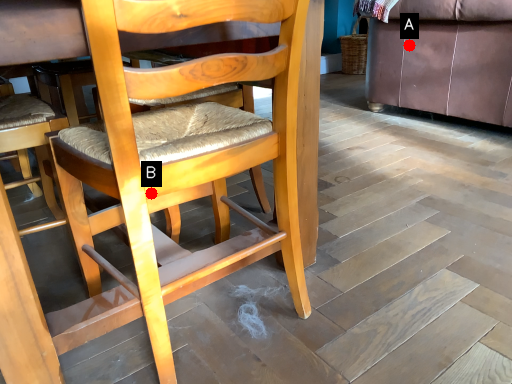
Question: Two points are circled on the image, labeled by A and B beside each circle. Which point is further to the camera?

Choices:
 (A) A is further
 (B) B is further

Answer: (A)